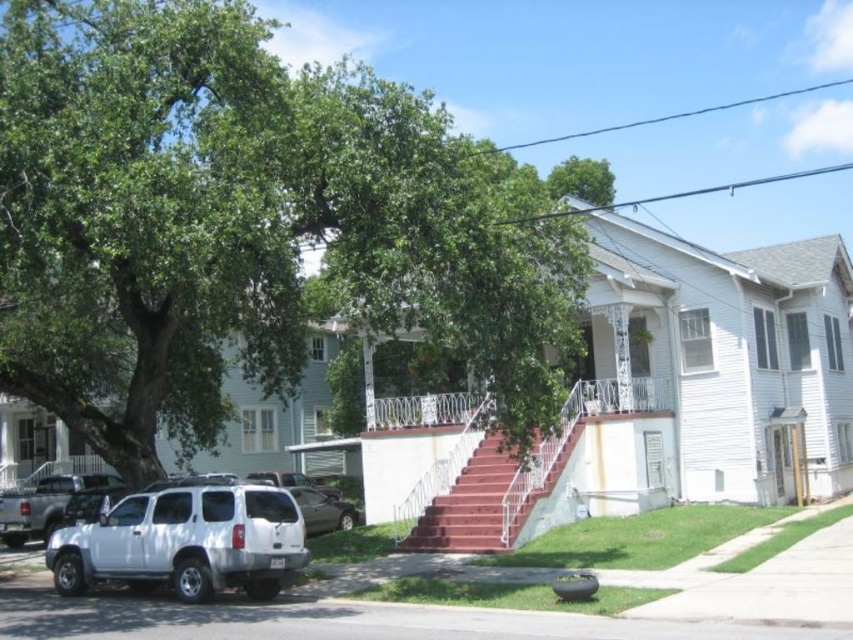
Is the position of white matte suv at lower left less distant than that of metallic gray sedan at lower center?

Yes.

Between point (257, 580) and point (343, 529), which one is positioned in front?

Positioned in front is point (257, 580).

Image resolution: width=853 pixels, height=640 pixels. In order to click on white matte suv at lower left in this screenshot , I will do `click(186, 541)`.

Does point (199, 144) come in front of point (437, 499)?

Yes.

Which is below, green leafy tree at upper left or smooth red stairs at center?

smooth red stairs at center

The width and height of the screenshot is (853, 640). In order to click on green leafy tree at upper left in this screenshot , I will do `click(244, 225)`.

The image size is (853, 640). Find the location of `green leafy tree at upper left`. green leafy tree at upper left is located at coordinates (244, 225).

In the scene shown: Does smooth red stairs at center have a lesser height compared to metallic gray sedan at lower center?

No, smooth red stairs at center is not shorter than metallic gray sedan at lower center.

Between smooth red stairs at center and metallic gray sedan at lower center, which one appears on the left side from the viewer's perspective?

From the viewer's perspective, metallic gray sedan at lower center appears more on the left side.

Which is behind, point (495, 483) or point (312, 518)?

The point (312, 518) is more distant.

I want to click on smooth red stairs at center, so click(468, 506).